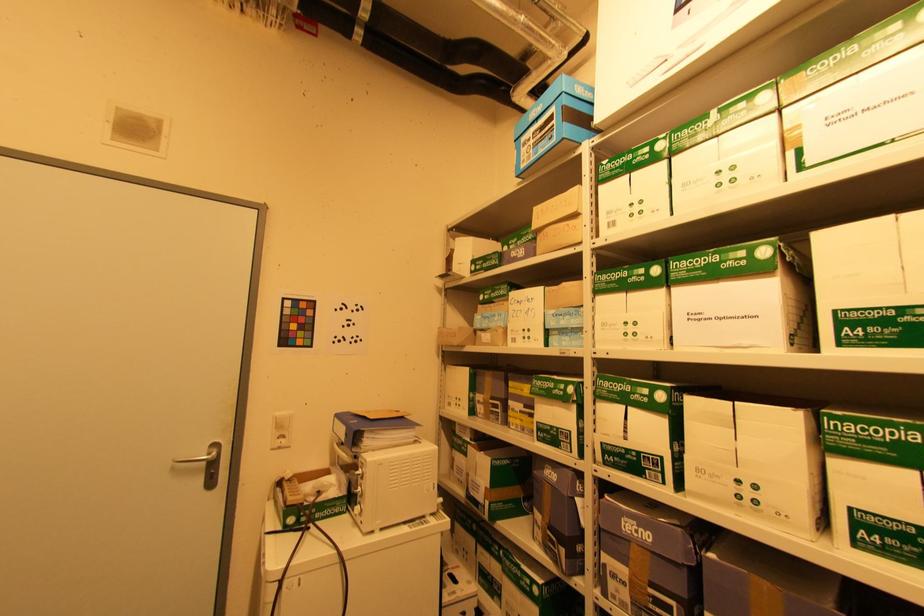
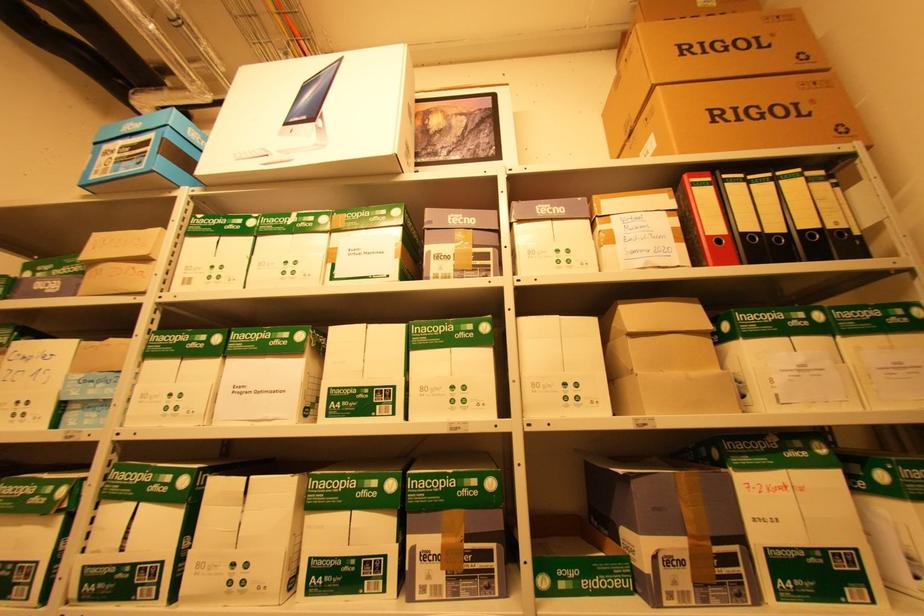
Question: The camera is either moving clockwise (left) or counter-clockwise (right) around the object. The first image is from the beginning of the video and the second image is from the end. Is the camera moving left or right when shooting the video?

Choices:
 (A) Left
 (B) Right

Answer: (A)